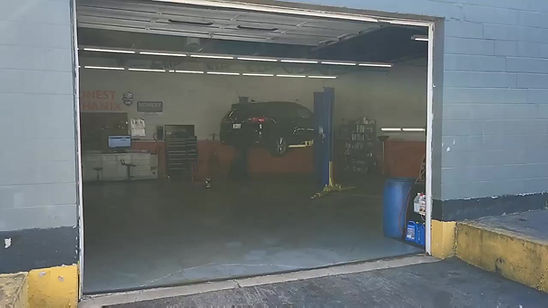
Where is `cement floor`? The height and width of the screenshot is (308, 548). cement floor is located at coordinates (211, 250).